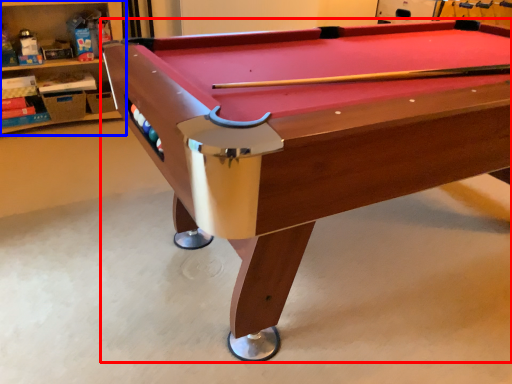
Question: Which object appears closest to the camera in this image, billiard table (highlighted by a red box) or shelf (highlighted by a blue box)?

Choices:
 (A) billiard table
 (B) shelf

Answer: (A)